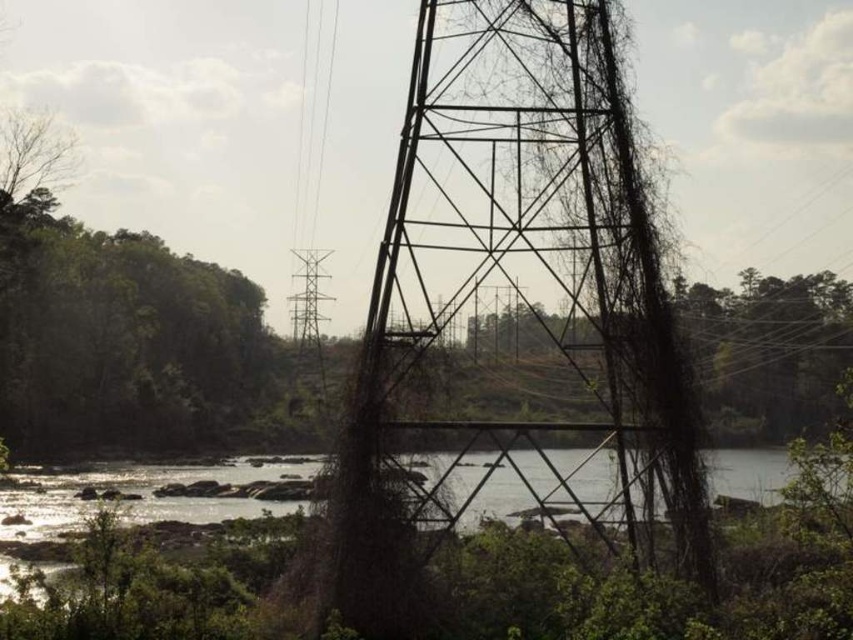
Who is more distant from viewer, (662, 381) or (309, 369)?

Point (309, 369)

In the scene shown: Can you confirm if rusty metal tower at center is positioned above metallic wire tower at center?

Correct, rusty metal tower at center is located above metallic wire tower at center.

Is point (589, 378) farther from camera compared to point (306, 273)?

No, (589, 378) is in front of (306, 273).

The image size is (853, 640). I want to click on rusty metal tower at center, so click(x=515, y=296).

Is bare branches at upper left in front of metallic wire tower at center?

No, it is behind metallic wire tower at center.

Between bare branches at upper left and metallic wire tower at center, which one is positioned lower?

metallic wire tower at center

Between point (3, 129) and point (305, 333), which one is positioned behind?

Positioned behind is point (3, 129).

This screenshot has width=853, height=640. I want to click on bare branches at upper left, so click(x=33, y=154).

Measure the distance between rusty metal tower at center and bare branches at upper left.

A distance of 30.97 meters exists between rusty metal tower at center and bare branches at upper left.

The height and width of the screenshot is (640, 853). What are the coordinates of `rusty metal tower at center` in the screenshot? It's located at (515, 296).

Between point (514, 68) and point (0, 163), which one is positioned behind?

The point (0, 163) is behind.

Where is `rusty metal tower at center`? The height and width of the screenshot is (640, 853). rusty metal tower at center is located at coordinates (515, 296).